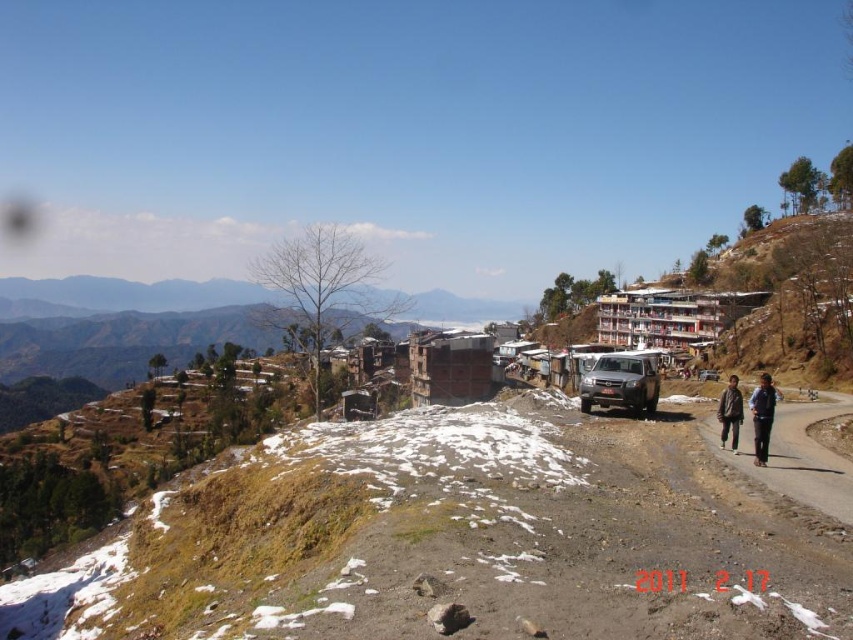
You are a hiker who wants to place a 1.2 meter long backpack between the dark brown leather jacket at lower right and the brown fabric jacket at lower right. Is there enough space between them to fit the backpack?

The dark brown leather jacket at lower right and brown fabric jacket at lower right are 1.30 meters apart from each other, so yes, the backpack can fit between them since the distance is greater than the backpack length.

You are standing at the top of the mountain looking down at the two jackets, dark brown leather jacket at lower right and brown fabric jacket at lower right. Which jacket is positioned closer to you?

The dark brown leather jacket at lower right is closer to the viewer than the brown fabric jacket at lower right.